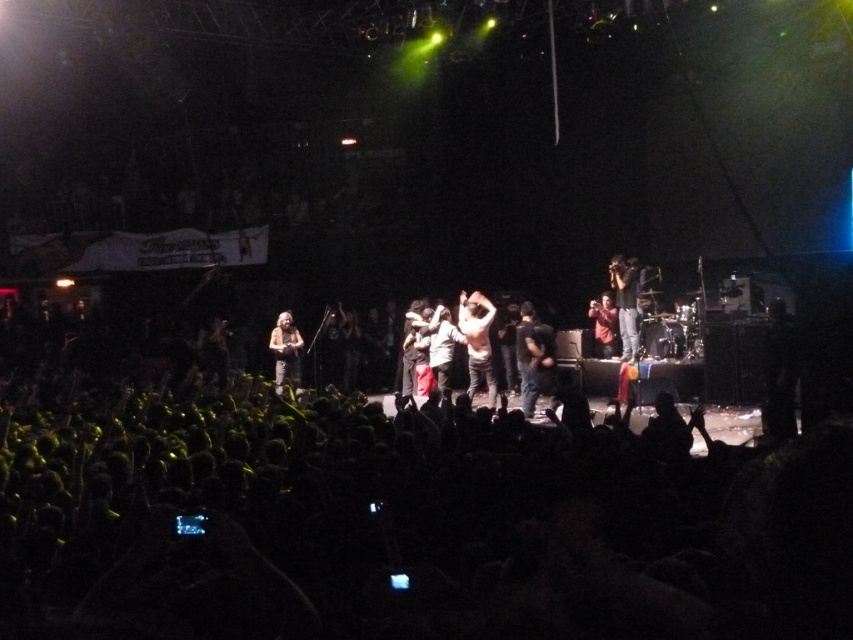
What do you see at coordinates (477, 340) in the screenshot? The image size is (853, 640). I see `shiny silver shirt at center` at bounding box center [477, 340].

Can you confirm if shiny silver shirt at center is positioned to the left of matte black shirt at center?

Yes, shiny silver shirt at center is to the left of matte black shirt at center.

Locate an element on the screen. Image resolution: width=853 pixels, height=640 pixels. shiny silver shirt at center is located at coordinates (477, 340).

In the scene shown: Can you confirm if shiny silver shirt at center is taller than shiny gold guitar at center?

Yes, shiny silver shirt at center is taller than shiny gold guitar at center.

Where is `shiny silver shirt at center`? Image resolution: width=853 pixels, height=640 pixels. shiny silver shirt at center is located at coordinates (477, 340).

The width and height of the screenshot is (853, 640). I want to click on shiny silver shirt at center, so click(477, 340).

Is black matte shirt at center taller than light brown leather jacket at center?

Yes, black matte shirt at center is taller than light brown leather jacket at center.

Who is positioned more to the right, black matte shirt at center or light brown leather jacket at center?

From the viewer's perspective, black matte shirt at center appears more on the right side.

Does point (537, 396) come behind point (439, 364)?

No, it is not.

I want to click on black matte shirt at center, so click(x=531, y=355).